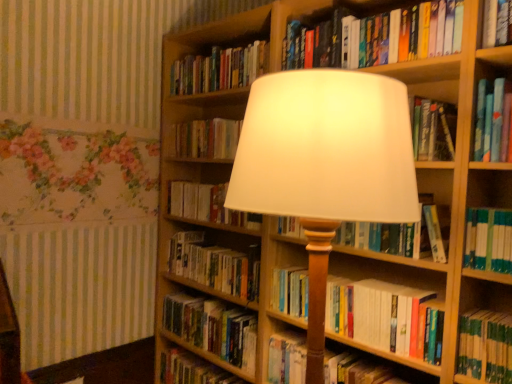
Question: Is point (174, 360) closer or farther from the camera than point (224, 150)?

Choices:
 (A) closer
 (B) farther

Answer: (B)

Question: From a real-world perspective, is hardcover book at lower center, acting as the 1th book starting from the bottom, physically located above or below hardcover book at center, which is counted as the eighth book, starting from the bottom?

Choices:
 (A) below
 (B) above

Answer: (A)

Question: Estimate the real-world distances between objects in this image. Which object is farther from the hardcover book at upper center, the tenth book ordered from the bottom?

Choices:
 (A) hardcover books at center, marked as the fourth book in a bottom-to-top arrangement
 (B) hardcover book at upper center, which is the ninth book from bottom to top
 (C) white paper book at center, which appears as the fourth book when viewed from the top
 (D) hardcover book at lower center, the 10th book when ordered from top to bottom
 (E) hardcover book at center, arranged as the ninth book when viewed from the top

Answer: (D)

Question: Estimate the real-world distances between objects in this image. Which object is farther from the hardcover book at upper center, which is the ninth book from bottom to top?

Choices:
 (A) hardcover book at center, positioned as the second book in bottom-to-top order
 (B) hardcover book at center, positioned as the 5th book in bottom-to-top order
 (C) hardcover book at lower center, acting as the 1th book starting from the bottom
 (D) hardcover book at center, which is counted as the eighth book, starting from the bottom
 (E) hardcover book at center, the eighth book from the top

Answer: (C)